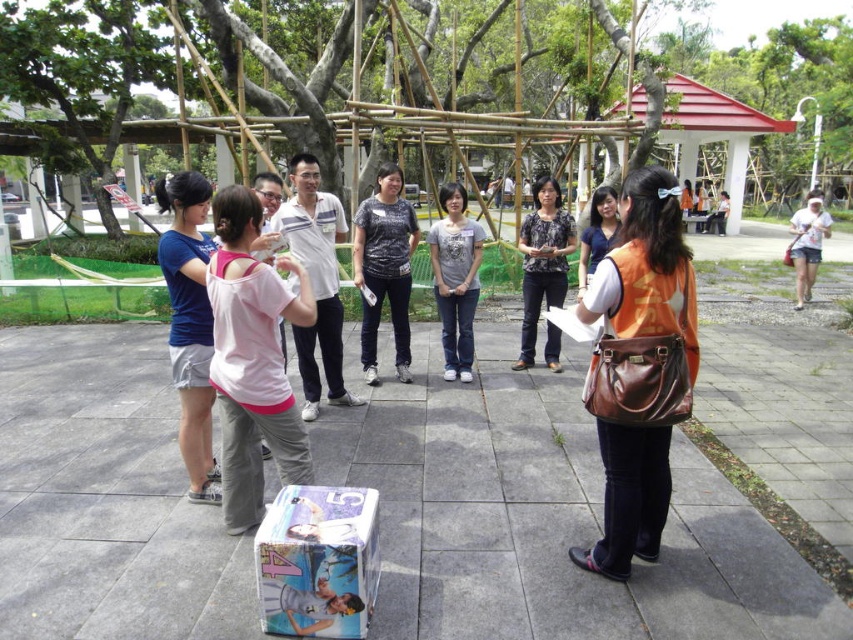
Does camouflage shirt at center appear over matte blue shirt at center?

Actually, camouflage shirt at center is below matte blue shirt at center.

Who is more distant from viewer, (370, 220) or (601, 192)?

The point (601, 192) is more distant.

Find the location of a particular element. This screenshot has width=853, height=640. camouflage shirt at center is located at coordinates (384, 268).

Can you confirm if matte gray shirt at center is thinner than white cotton shirt at right?

Yes.

Does matte gray shirt at center appear over white cotton shirt at right?

No.

The height and width of the screenshot is (640, 853). I want to click on matte gray shirt at center, so click(x=456, y=280).

Measure the distance between point (398, 268) and camera.

Point (398, 268) and camera are 5.97 meters apart.

Does camouflage shirt at center have a lesser width compared to white cotton shirt at right?

Yes.

Is point (390, 195) farther from viewer compared to point (816, 205)?

No, (390, 195) is closer to viewer.

Find the location of a particular element. This screenshot has width=853, height=640. camouflage shirt at center is located at coordinates (384, 268).